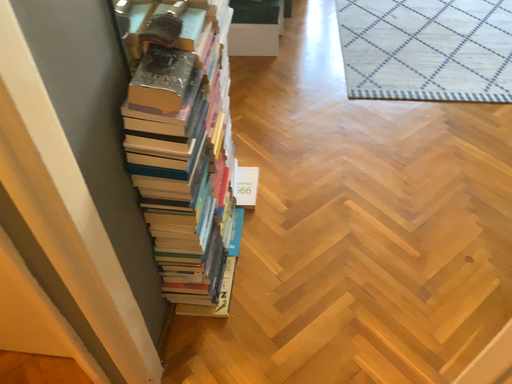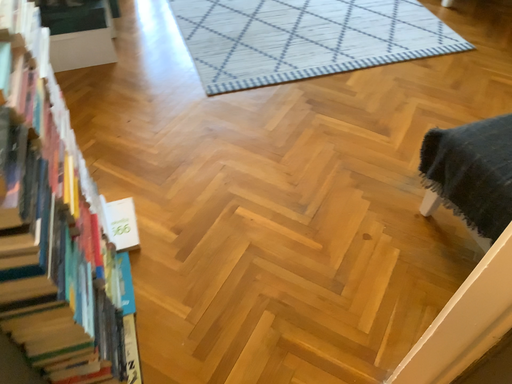
Question: Which way did the camera rotate in the video?

Choices:
 (A) rotated right
 (B) rotated left

Answer: (A)